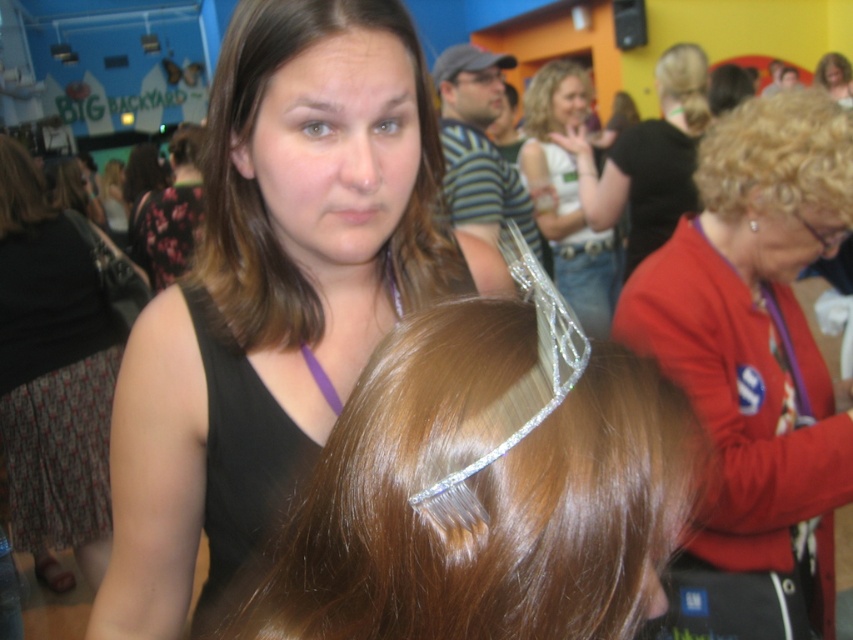
Between floral fabric dress at upper left and clear plastic tiara at upper center, which one appears on the left side from the viewer's perspective?

From the viewer's perspective, floral fabric dress at upper left appears more on the left side.

Does floral fabric dress at upper left lie behind clear plastic tiara at upper center?

Yes.

Does point (175, 196) lie in front of point (511, 93)?

That is True.

Where is `floral fabric dress at upper left`? This screenshot has width=853, height=640. floral fabric dress at upper left is located at coordinates (170, 212).

Which of these two, floral fabric dress at upper left or matte black cap at upper center, stands taller?

Standing taller between the two is floral fabric dress at upper left.

Between point (164, 221) and point (463, 118), which one is positioned in front?

Point (463, 118) is more forward.

Between point (169, 244) and point (498, 54), which one is positioned in front?

Positioned in front is point (498, 54).

You are a GUI agent. You are given a task and a screenshot of the screen. Output one action in this format:
    pyautogui.click(x=<x>, y=<y>)
    Task: Click on the floral fabric dress at upper left
    
    Given the screenshot: What is the action you would take?
    (x=170, y=212)

Is blonde curly hair at upper right to the left of shiny silver tiara at upper center from the viewer's perspective?

Yes, blonde curly hair at upper right is to the left of shiny silver tiara at upper center.

Based on the photo, can you confirm if blonde curly hair at upper right is positioned below shiny silver tiara at upper center?

Correct, blonde curly hair at upper right is located below shiny silver tiara at upper center.

Who is more forward, [834,120] or [556,113]?

Point [834,120] is more forward.

Where is `blonde curly hair at upper right`? blonde curly hair at upper right is located at coordinates (778, 156).